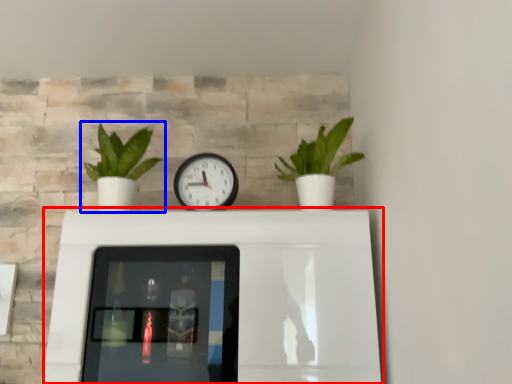
Question: Which point is closer to the camera, table (highlighted by a red box) or houseplant (highlighted by a blue box)?

Choices:
 (A) table
 (B) houseplant

Answer: (A)